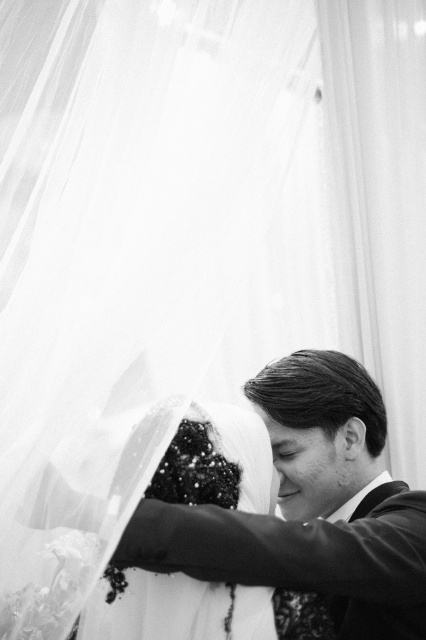
Based on the photo, is smooth black suit at center below sequined fabric veil at center?

Yes, smooth black suit at center is below sequined fabric veil at center.

Does smooth black suit at center appear on the left side of sequined fabric veil at center?

No, smooth black suit at center is not to the left of sequined fabric veil at center.

You are a GUI agent. You are given a task and a screenshot of the screen. Output one action in this format:
    pyautogui.click(x=<x>, y=<y>)
    Task: Click on the smooth black suit at center
    The width and height of the screenshot is (426, 640).
    Given the screenshot: What is the action you would take?
    pyautogui.click(x=308, y=508)